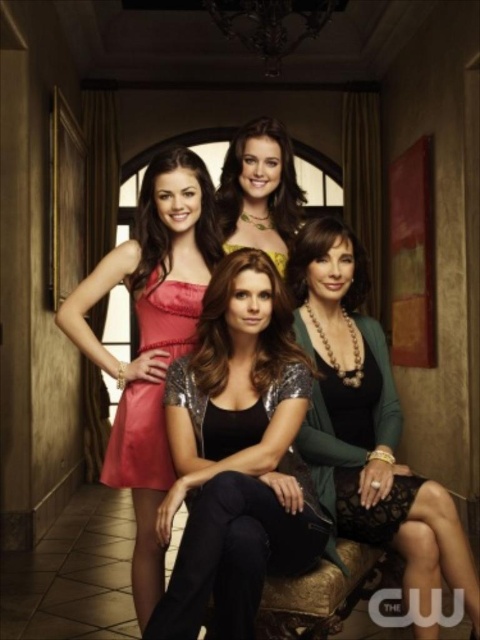
You are a photographer setting up for a group photo. You need to ensure that the green textured cardigan at center and the satin dress at left are both visible in the frame. Based on their heights, which one might you need to adjust the camera angle for to ensure both are fully captured?

The green textured cardigan at center is not as tall as the satin dress at left, so you might need to lower the camera angle slightly to ensure the taller satin dress at left is fully captured while keeping the shorter green textured cardigan at center in view.

You are standing in the hallway and want to move from the point at coordinates point [348,419] to the point at coordinates point [180,352]. Which direction should you move to get closer to your destination?

To move from point [348,419] to point [180,352], you should move in a direction that decreases both the x and y coordinates since the destination has lower x and y values than the starting point.